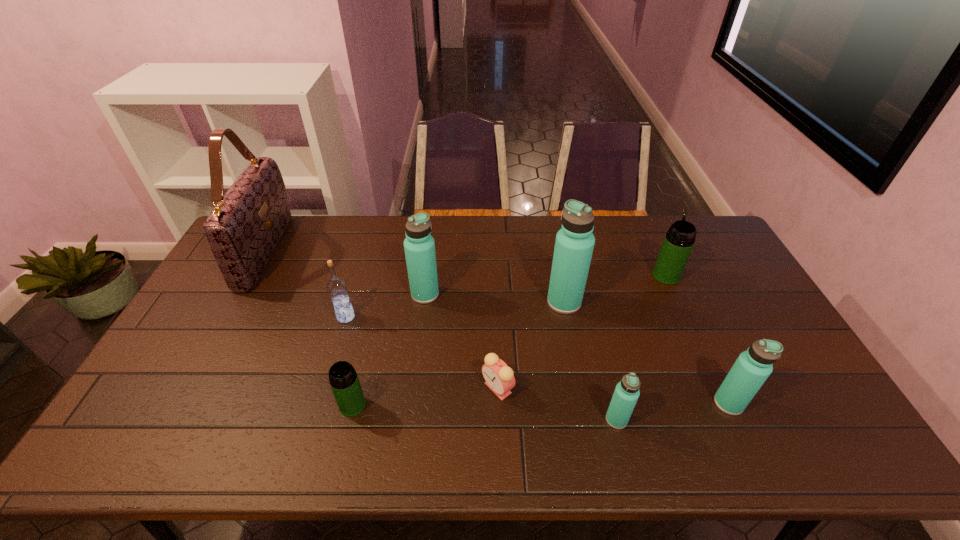
Find the location of a particular element. This screenshot has height=540, width=960. free spot between the right green thermos bottle and the brown handbag is located at coordinates (466, 264).

Where is `vacant space that's between the right green thermos bottle and the handbag`? vacant space that's between the right green thermos bottle and the handbag is located at coordinates (466, 264).

Identify the location of unoccupied area between the second tallest object and the rightmost aqua thermos bottle. Image resolution: width=960 pixels, height=540 pixels. (646, 353).

The height and width of the screenshot is (540, 960). In order to click on free spot between the smallest aqua thermos bottle and the biggest aqua thermos bottle in this screenshot , I will do `click(590, 361)`.

You are a GUI agent. You are given a task and a screenshot of the screen. Output one action in this format:
    pyautogui.click(x=<x>, y=<y>)
    Task: Click on the unoccupied position between the tallest object and the vodka
    The image size is (960, 540).
    Given the screenshot: What is the action you would take?
    pyautogui.click(x=306, y=284)

Identify the location of free point between the farther green thermos bottle and the leftmost object. The image size is (960, 540). (466, 264).

Identify the location of vacant region between the right green thermos bottle and the smallest aqua thermos bottle. (641, 348).

Identify the location of vacant space that's between the third biggest aqua thermos bottle and the smallest aqua thermos bottle. Image resolution: width=960 pixels, height=540 pixels. (672, 411).

The image size is (960, 540). Identify the location of object that stands as the third closest to the vodka. (243, 229).

Locate which object is the fourth closest to the third biggest aqua thermos bottle. Please provide its 2D coordinates. Your answer should be formatted as a tuple, i.e. [(x, y)], where the tuple contains the x and y coordinates of a point satisfying the conditions above.

[(499, 377)]